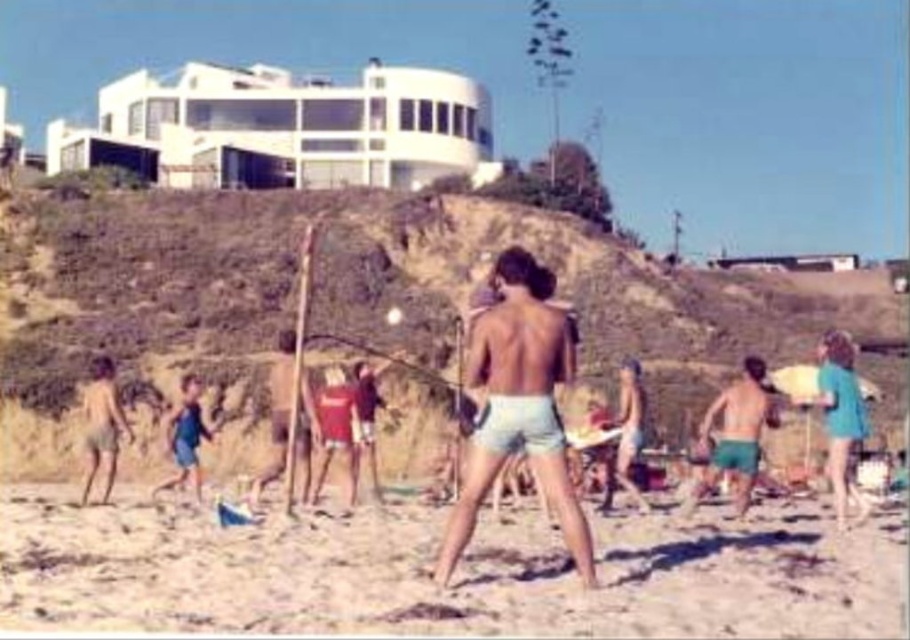
Question: Observing the image, what is the correct spatial positioning of light blue denim shorts at center in reference to blue fabric shorts at lower left?

Choices:
 (A) above
 (B) below

Answer: (A)

Question: Which of the following is the farthest from the observer?

Choices:
 (A) tan skin child at left
 (B) brown grassy hillside at upper center
 (C) light blue denim shorts at center
 (D) blue fabric surfboard at right

Answer: (B)

Question: Does light blue denim shorts at center have a greater width compared to blue fabric shorts at lower left?

Choices:
 (A) yes
 (B) no

Answer: (B)

Question: Can you confirm if light blue denim shorts at center is smaller than blue fabric shorts at lower left?

Choices:
 (A) yes
 (B) no

Answer: (B)

Question: Which point is farther to the camera?

Choices:
 (A) light brown sand at center
 (B) blue fabric surfboard at right

Answer: (B)

Question: Considering the real-world distances, which object is farthest from the tan skin child at left?

Choices:
 (A) blue fabric shorts at lower left
 (B) blue fabric surfboard at right

Answer: (B)